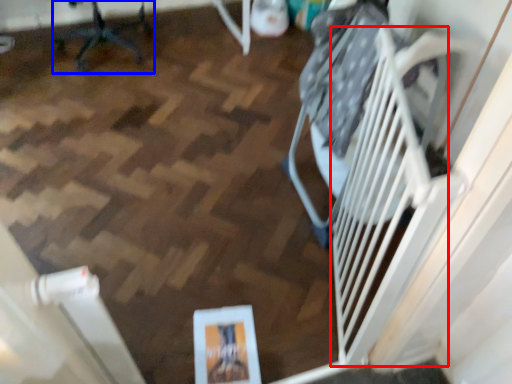
Question: Which of the following is the farthest to the observer, stairs (highlighted by a red box) or furniture (highlighted by a blue box)?

Choices:
 (A) stairs
 (B) furniture

Answer: (B)